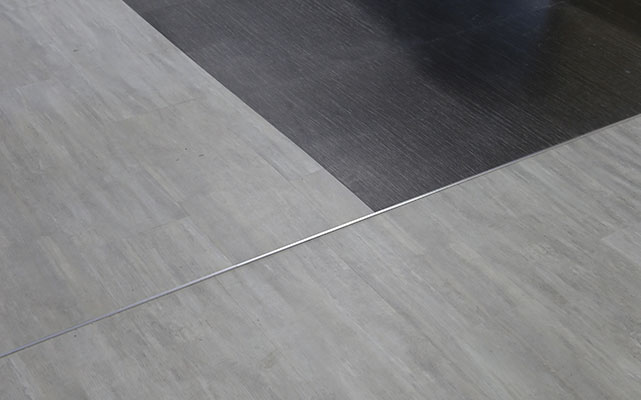
At what (x,y) coordinates should I click in order to perform the action: click on dark gray line in gray flooring. Please return your answer as a coordinate pair (x, y). This screenshot has width=641, height=400. Looking at the image, I should click on (275, 165).